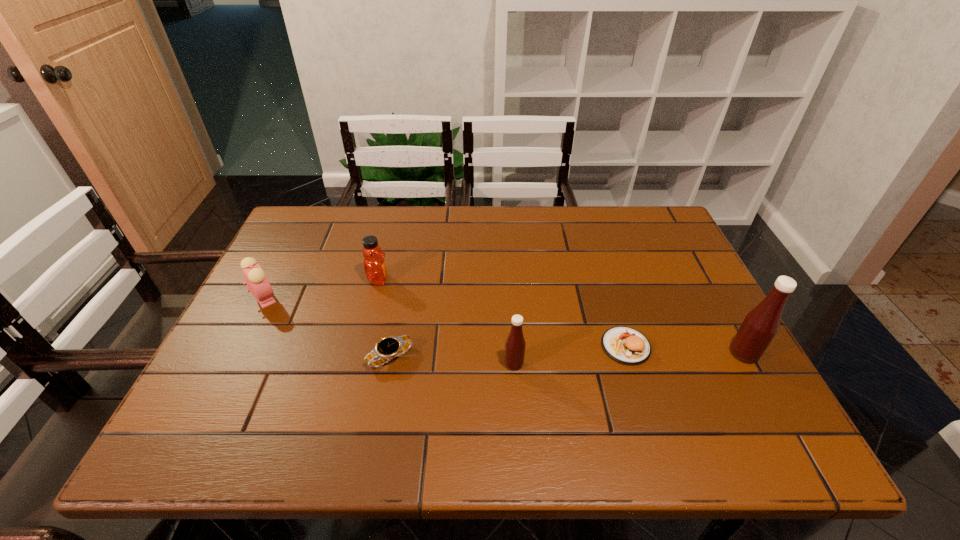
Identify the location of empty space between the leftmost object and the shorter Tabasco sauce. This screenshot has width=960, height=540. (390, 331).

Identify which object is located as the fourth nearest to the fifth tallest object. Please provide its 2D coordinates. Your answer should be formatted as a tuple, i.e. [(x, y)], where the tuple contains the x and y coordinates of a point satisfying the conditions above.

[(375, 269)]

Select which object appears as the fourth closest to the shortest object. Please provide its 2D coordinates. Your answer should be formatted as a tuple, i.e. [(x, y)], where the tuple contains the x and y coordinates of a point satisfying the conditions above.

[(626, 345)]

Where is `free location that satisfies the following two spatial constraints: 1. on the face of the taller Tabasco sauce; 2. on the left side of the alarm clock`? free location that satisfies the following two spatial constraints: 1. on the face of the taller Tabasco sauce; 2. on the left side of the alarm clock is located at coordinates (236, 354).

Identify the location of blank area in the image that satisfies the following two spatial constraints: 1. on the front label of the shortest object; 2. on the left side of the honey. Image resolution: width=960 pixels, height=540 pixels. (359, 357).

Image resolution: width=960 pixels, height=540 pixels. I want to click on free region that satisfies the following two spatial constraints: 1. on the face of the third shortest object; 2. on the back side of the shortest object, so click(x=234, y=357).

This screenshot has width=960, height=540. I want to click on vacant region that satisfies the following two spatial constraints: 1. on the front label of the tallest object; 2. on the right side of the honey, so pos(360,354).

Image resolution: width=960 pixels, height=540 pixels. In order to click on free location that satisfies the following two spatial constraints: 1. on the face of the leftmost object; 2. on the right side of the left Tabasco sauce in this screenshot , I will do `click(230, 364)`.

Locate an element on the screen. free space that satisfies the following two spatial constraints: 1. on the back side of the rightmost object; 2. on the face of the fourth tallest object is located at coordinates (712, 298).

You are a GUI agent. You are given a task and a screenshot of the screen. Output one action in this format:
    pyautogui.click(x=<x>, y=<y>)
    Task: Click on the vacant region that satisfies the following two spatial constraints: 1. on the back side of the shorter Tabasco sauce; 2. on the right side of the rightmost object
    Image resolution: width=960 pixels, height=540 pixels.
    Given the screenshot: What is the action you would take?
    pyautogui.click(x=514, y=354)